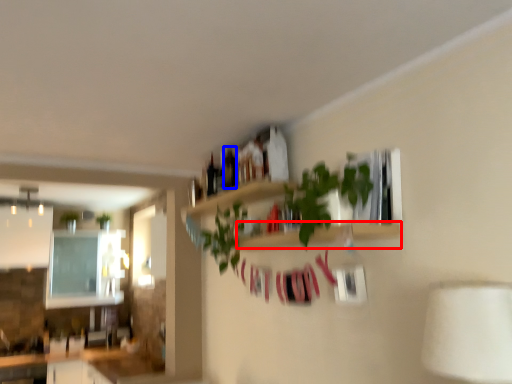
Question: Which object is closer to the camera taking this photo, shelf (highlighted by a red box) or bottle (highlighted by a blue box)?

Choices:
 (A) shelf
 (B) bottle

Answer: (A)